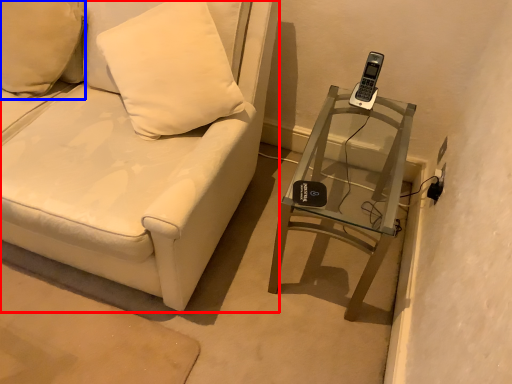
Question: Which point is closer to the camera, furniture (highlighted by a red box) or pillow (highlighted by a blue box)?

Choices:
 (A) furniture
 (B) pillow

Answer: (A)